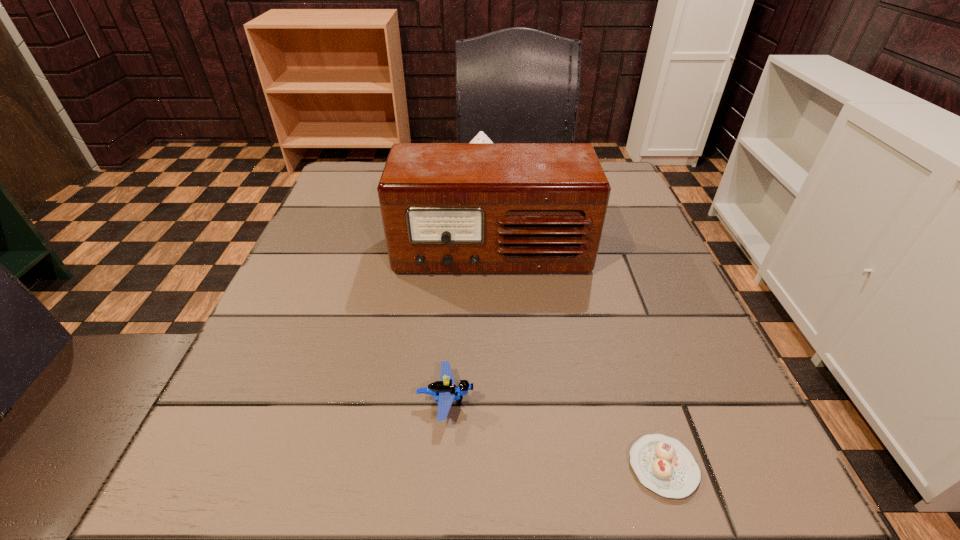
You are a GUI agent. You are given a task and a screenshot of the screen. Output one action in this format:
    pyautogui.click(x=<x>, y=<y>)
    Task: Click on the free space at the far left corner of the desktop
    The height and width of the screenshot is (540, 960).
    Given the screenshot: What is the action you would take?
    pyautogui.click(x=341, y=169)

In the image, there is a desktop. Where is `free region at the near right corner`? free region at the near right corner is located at coordinates 712,458.

You are a GUI agent. You are given a task and a screenshot of the screen. Output one action in this format:
    pyautogui.click(x=<x>, y=<y>)
    Task: Click on the empty space that is in between the farthest object and the second shortest object
    
    Given the screenshot: What is the action you would take?
    pyautogui.click(x=464, y=286)

Where is `empty space between the radio receiver and the shortest object`? The image size is (960, 540). empty space between the radio receiver and the shortest object is located at coordinates (577, 360).

Identify the location of free space between the left cupcake and the third tallest object. The height and width of the screenshot is (540, 960). (464, 286).

This screenshot has width=960, height=540. Identify the location of blank region between the Lego and the nearest object. (554, 434).

The width and height of the screenshot is (960, 540). I want to click on vacant space that's between the shorter cupcake and the tallest object, so click(x=577, y=360).

At what (x,y) coordinates should I click in order to perform the action: click on free spot between the Lego and the shorter cupcake. Please return your answer as a coordinate pair (x, y). This screenshot has height=540, width=960. Looking at the image, I should click on (554, 434).

Find the location of `vacant space that's between the tallest object and the nearest object`. vacant space that's between the tallest object and the nearest object is located at coordinates (577, 360).

At what (x,y) coordinates should I click in order to perform the action: click on free area in between the farther cupcake and the Lego. Please return your answer as a coordinate pair (x, y). This screenshot has height=540, width=960. Looking at the image, I should click on (464, 286).